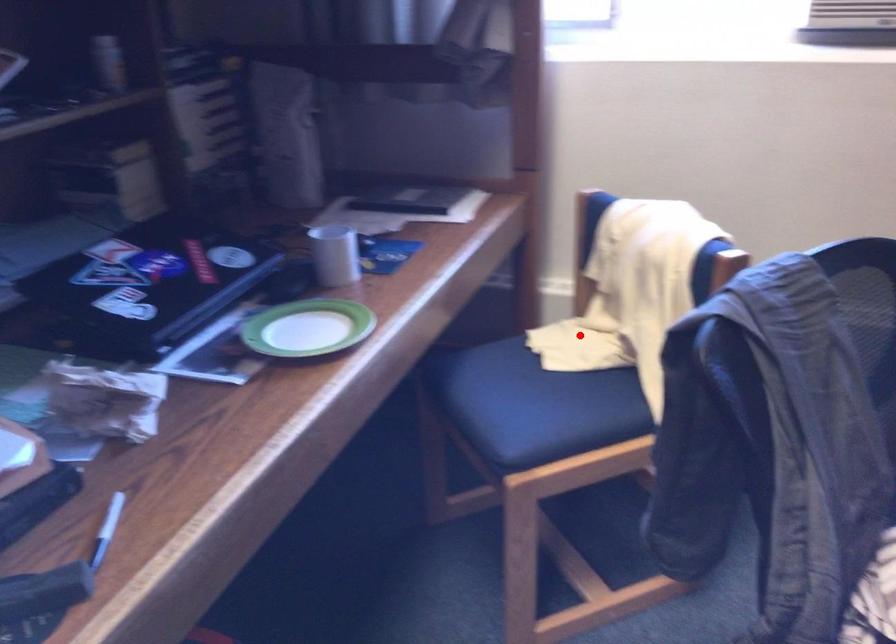
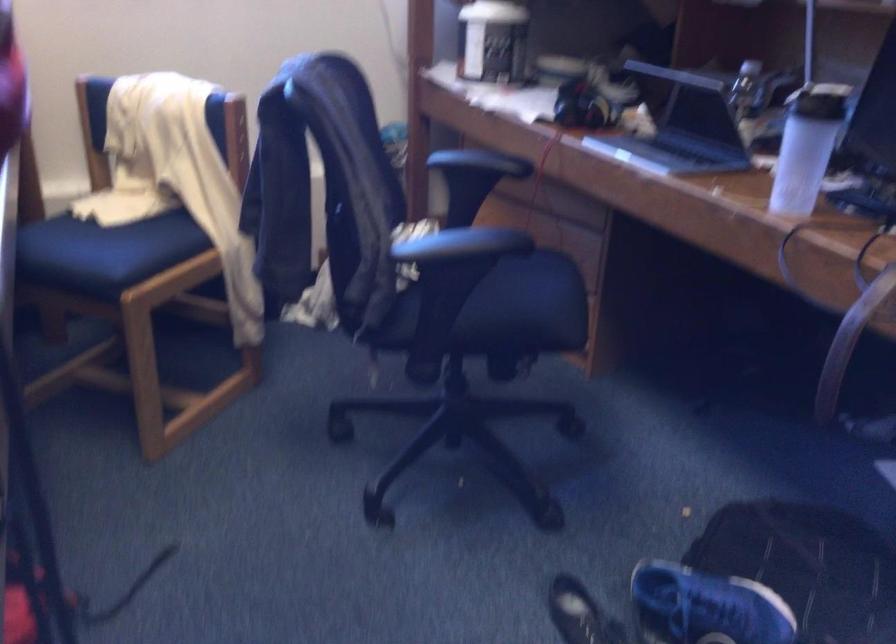
Question: A red point is marked in image1. In image2, is the corresponding 3D point closer to the camera or farther? Reply with the corresponding letter.

Choices:
 (A) The corresponding 3D point is closer.
 (B) The corresponding 3D point is farther.

Answer: (B)